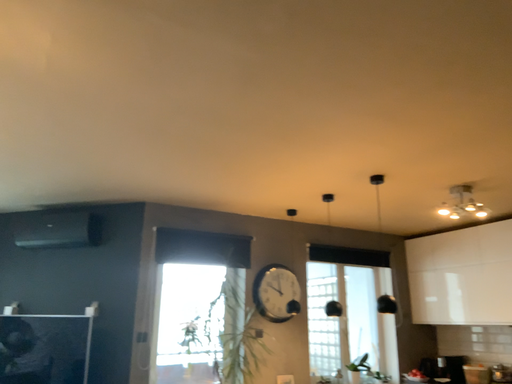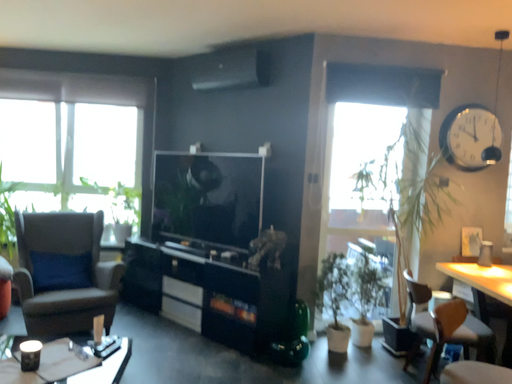
Question: Which way did the camera rotate in the video?

Choices:
 (A) rotated left
 (B) rotated right

Answer: (A)